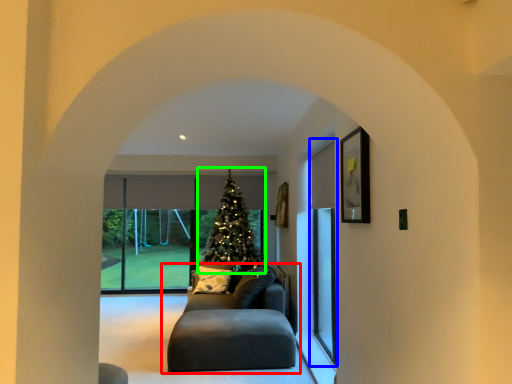
Question: Which is nearer to the studio couch (highlighted by a red box)? screen door (highlighted by a blue box) or christmas tree (highlighted by a green box).

Choices:
 (A) screen door
 (B) christmas tree

Answer: (A)